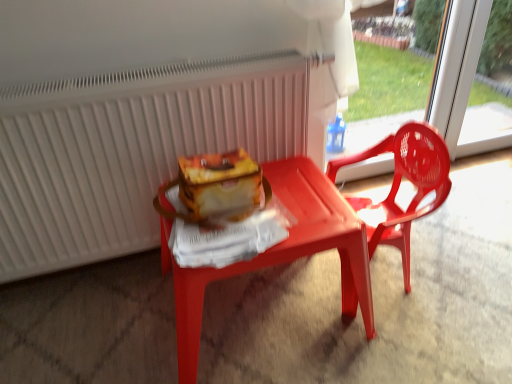
Question: From a real-world perspective, is matte plastic table at center located higher than matte plastic chair at right?

Choices:
 (A) yes
 (B) no

Answer: (B)

Question: Is matte plastic table at center to the left of matte plastic chair at right from the viewer's perspective?

Choices:
 (A) no
 (B) yes

Answer: (B)

Question: From the image's perspective, is matte plastic table at center over matte plastic chair at right?

Choices:
 (A) yes
 (B) no

Answer: (B)

Question: Is matte plastic chair at right surrounded by matte plastic table at center?

Choices:
 (A) yes
 (B) no

Answer: (B)

Question: Is matte plastic table at center aimed at matte plastic chair at right?

Choices:
 (A) no
 (B) yes

Answer: (A)

Question: Visually, is matte plastic chair at right positioned to the left or to the right of white matte radiator at upper center?

Choices:
 (A) left
 (B) right

Answer: (B)

Question: Does point (433, 205) appear closer or farther from the camera than point (258, 130)?

Choices:
 (A) closer
 (B) farther

Answer: (A)

Question: Is matte plastic chair at right bigger or smaller than white matte radiator at upper center?

Choices:
 (A) small
 (B) big

Answer: (A)

Question: From their relative heights in the image, would you say matte plastic chair at right is taller or shorter than white matte radiator at upper center?

Choices:
 (A) short
 (B) tall

Answer: (A)

Question: From a real-world perspective, is matte plastic table at center above or below matte plastic chair at right?

Choices:
 (A) below
 (B) above

Answer: (A)

Question: From the image's perspective, is matte plastic table at center positioned above or below matte plastic chair at right?

Choices:
 (A) above
 (B) below

Answer: (B)

Question: Is point (354, 253) positioned closer to the camera than point (392, 231)?

Choices:
 (A) closer
 (B) farther

Answer: (A)

Question: Considering the relative positions of matte plastic table at center and matte plastic chair at right in the image provided, is matte plastic table at center to the left or to the right of matte plastic chair at right?

Choices:
 (A) left
 (B) right

Answer: (A)

Question: Relative to matte plastic table at center, is white matte radiator at upper center in front or behind?

Choices:
 (A) behind
 (B) front

Answer: (A)

Question: Looking at the image, does white matte radiator at upper center seem bigger or smaller compared to matte plastic table at center?

Choices:
 (A) small
 (B) big

Answer: (A)